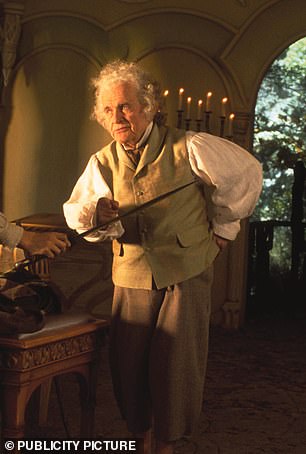
The image size is (306, 454). What are the coordinates of `ornate wood desk` in the screenshot? It's located at (29, 368).